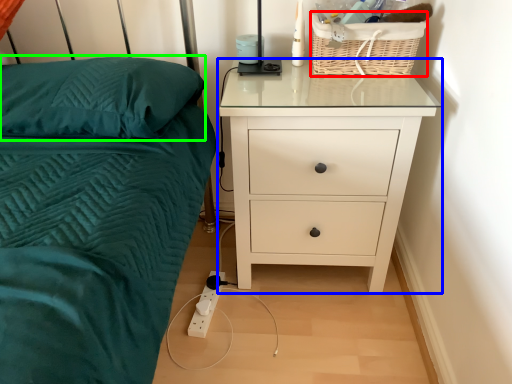
Question: Estimate the real-world distances between objects in this image. Which object is closer to basket (highlighted by a red box), chest of drawers (highlighted by a blue box) or pillow (highlighted by a green box)?

Choices:
 (A) chest of drawers
 (B) pillow

Answer: (A)